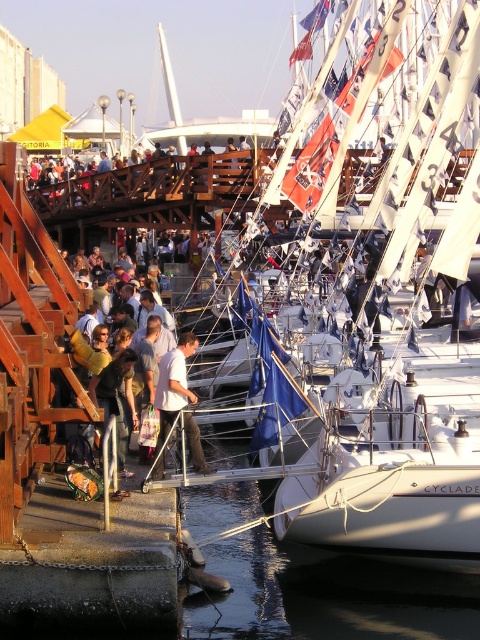
Question: Is light brown leather jacket at center above dark blue jeans at center?

Choices:
 (A) no
 (B) yes

Answer: (B)

Question: Which point is farther from the camera taking this photo?

Choices:
 (A) click(x=93, y=397)
 (B) click(x=158, y=381)
 (C) click(x=132, y=326)

Answer: (C)

Question: Which point is closer to the camera?

Choices:
 (A) (96, 403)
 (B) (181, 392)

Answer: (B)

Question: Is white cotton shirt at center positioned before dark blue jeans at center?

Choices:
 (A) yes
 (B) no

Answer: (B)

Question: Is white cotton shirt at center further to camera compared to dark blue jeans at center?

Choices:
 (A) yes
 (B) no

Answer: (A)

Question: Which point is farther to the camera?

Choices:
 (A) (177, 412)
 (B) (92, 381)
 (C) (127, 294)

Answer: (C)